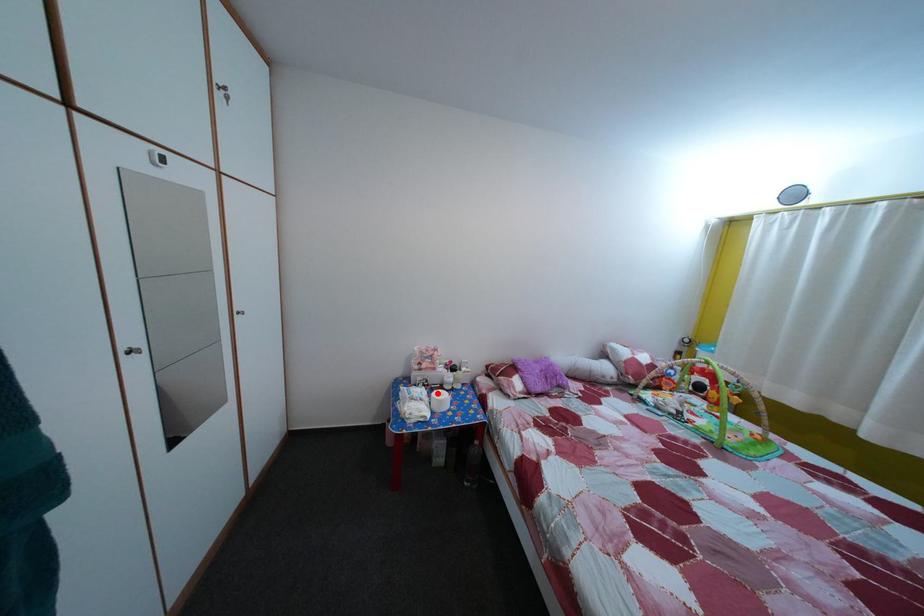
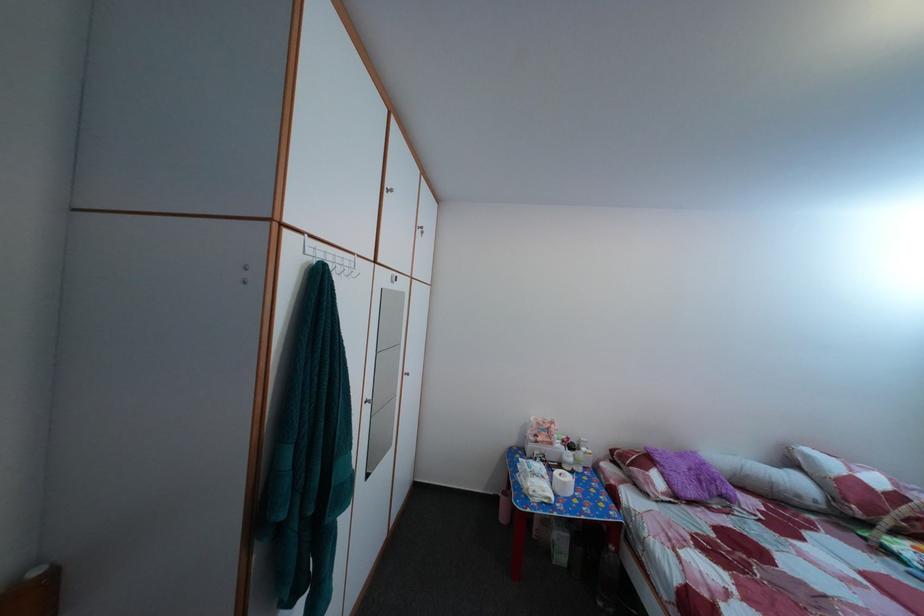
The point at the highlighted location is marked in the first image. Where is the corresponding point in the second image?

(555, 469)